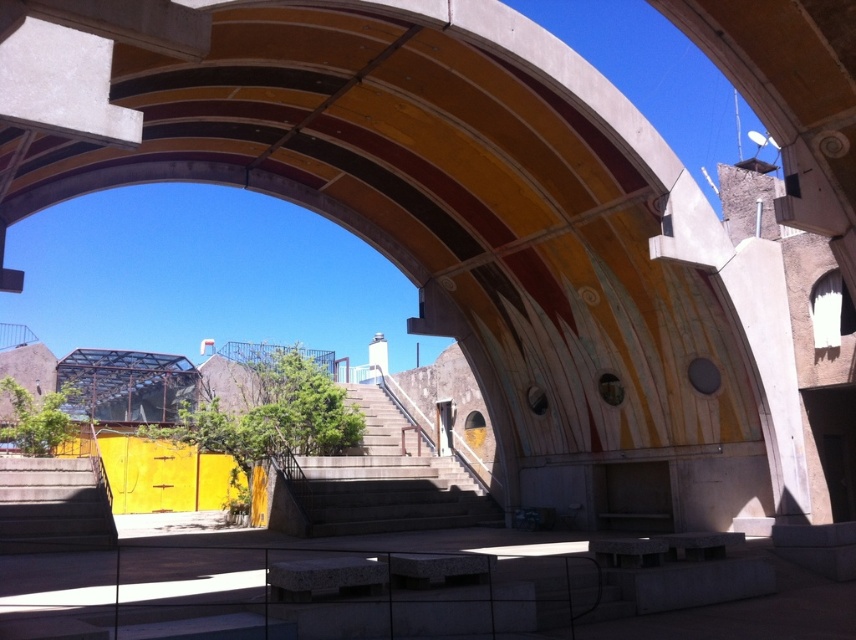
Question: Which object appears closest to the camera in this image?

Choices:
 (A) concrete stairs at center
 (B) gray concrete stairs at lower left

Answer: (B)

Question: Is concrete stairs at center thinner than gray concrete stairs at lower left?

Choices:
 (A) no
 (B) yes

Answer: (A)

Question: Which object appears closest to the camera in this image?

Choices:
 (A) gray concrete stairs at lower left
 (B) concrete stairs at center

Answer: (A)

Question: Does concrete stairs at center appear on the right side of gray concrete stairs at lower left?

Choices:
 (A) no
 (B) yes

Answer: (B)

Question: Is concrete stairs at center below gray concrete stairs at lower left?

Choices:
 (A) no
 (B) yes

Answer: (B)